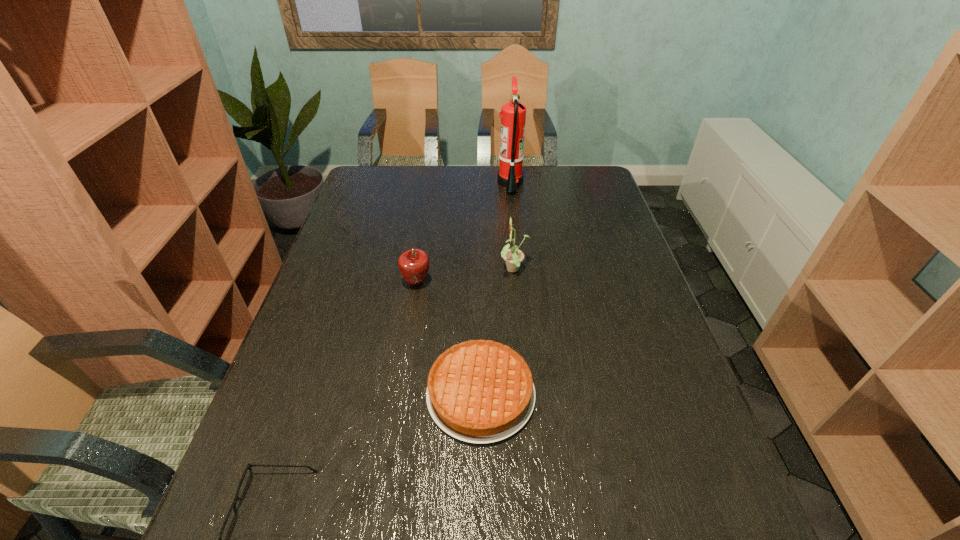
The height and width of the screenshot is (540, 960). What are the coordinates of `vacant region at the near right corner of the desktop` in the screenshot? It's located at (711, 539).

Locate an element on the screen. This screenshot has width=960, height=540. vacant point located between the second shortest object and the farthest object is located at coordinates (495, 289).

Where is `blank region between the fourth object from right to left and the farthest object`? This screenshot has width=960, height=540. blank region between the fourth object from right to left and the farthest object is located at coordinates (464, 233).

Where is `free space that is in between the fire extinguisher and the pie`? This screenshot has width=960, height=540. free space that is in between the fire extinguisher and the pie is located at coordinates (495, 289).

Image resolution: width=960 pixels, height=540 pixels. I want to click on free spot between the fourth tallest object and the fourth object from right to left, so click(448, 339).

At what (x,y) coordinates should I click in order to perform the action: click on vacant point located between the apple and the sunflower. Please return your answer as a coordinate pair (x, y). This screenshot has width=960, height=540. Looking at the image, I should click on (466, 276).

In order to click on the closest object relative to the apple in this screenshot , I will do 513,257.

Identify which object is located as the second nearest to the nearest object. Please provide its 2D coordinates. Your answer should be formatted as a tuple, i.e. [(x, y)], where the tuple contains the x and y coordinates of a point satisfying the conditions above.

[(414, 264)]